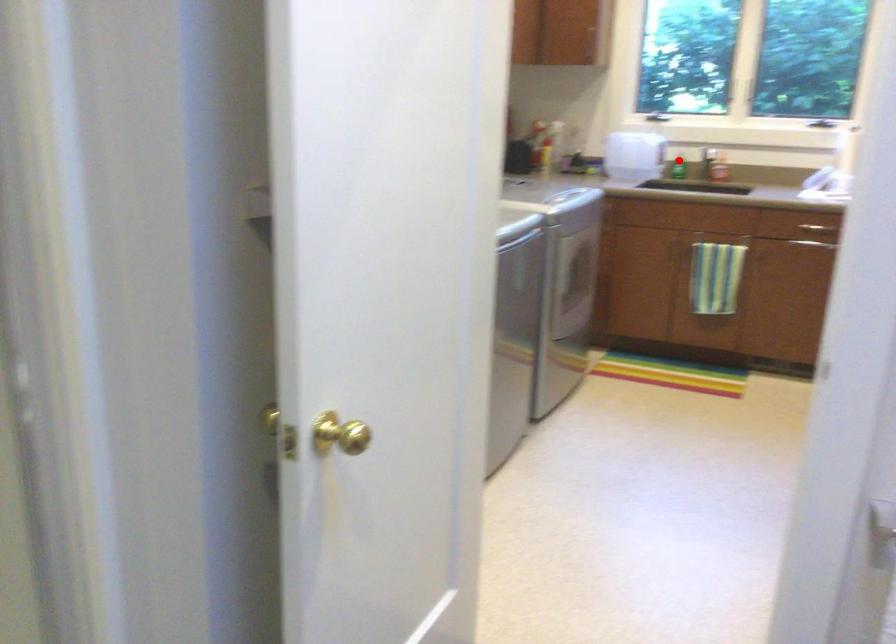
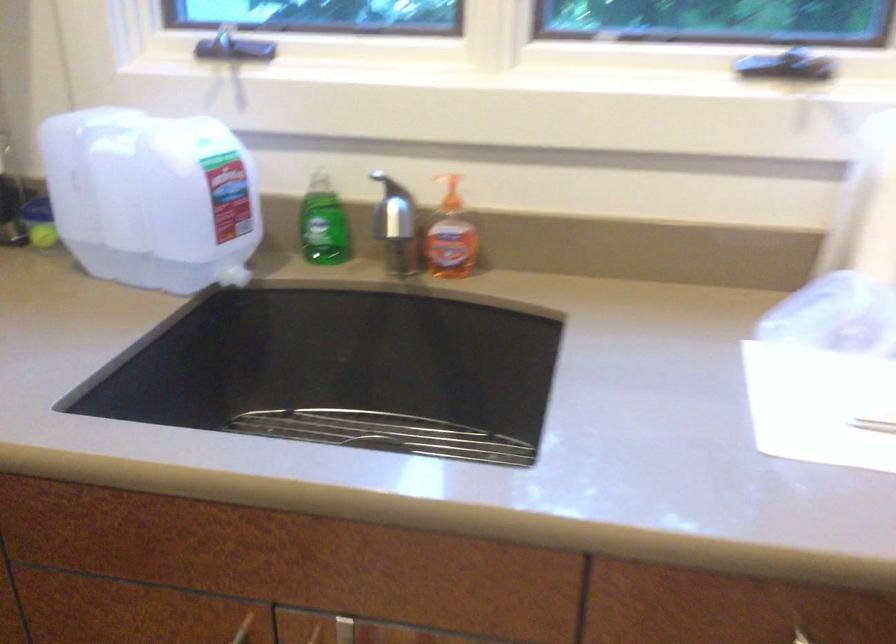
Find the pixel in the second image that matches the highlighted location in the first image.

(323, 223)